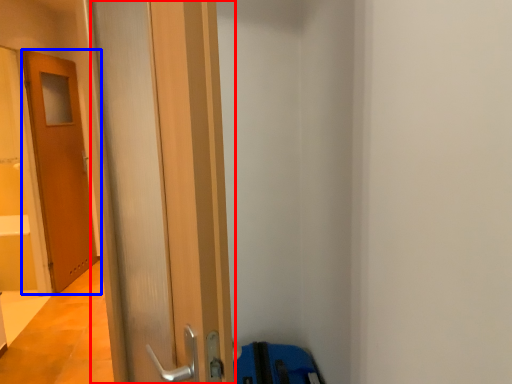
Question: Which point is closer to the camera, door (highlighted by a red box) or door (highlighted by a blue box)?

Choices:
 (A) door
 (B) door

Answer: (A)